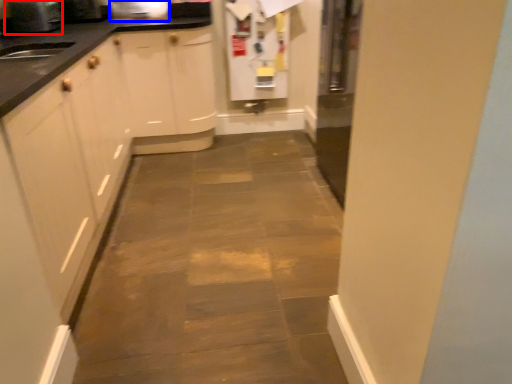
Question: Which object is closer to the camera taking this photo, appliance (highlighted by a red box) or appliance (highlighted by a blue box)?

Choices:
 (A) appliance
 (B) appliance

Answer: (A)